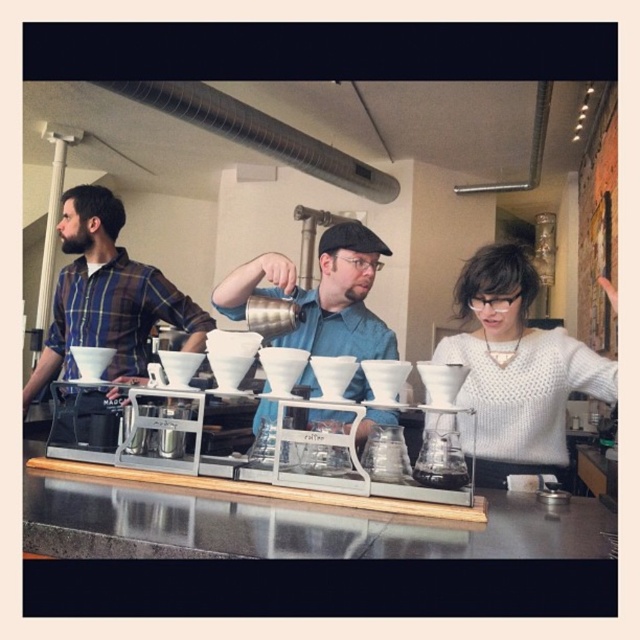
Question: In this image, where is plaid flannel shirt at left located relative to matte silver kettle at center?

Choices:
 (A) right
 (B) left

Answer: (B)

Question: Which object appears closest to the camera in this image?

Choices:
 (A) matte silver kettle at center
 (B) white knitted sweater at center

Answer: (B)

Question: Which object appears farthest from the camera in this image?

Choices:
 (A) white knitted sweater at center
 (B) plaid flannel shirt at left
 (C) transparent glass carafe at center
 (D) matte silver kettle at center

Answer: (C)

Question: Can you confirm if white knitted sweater at center is bigger than black matte exhaust hood at upper center?

Choices:
 (A) no
 (B) yes

Answer: (A)

Question: Which point is farther from the camera taking this photo?

Choices:
 (A) (566, 360)
 (B) (419, 280)
 (C) (106, 237)

Answer: (B)

Question: Can you confirm if matte silver kettle at center is thinner than black matte exhaust hood at upper center?

Choices:
 (A) no
 (B) yes

Answer: (B)